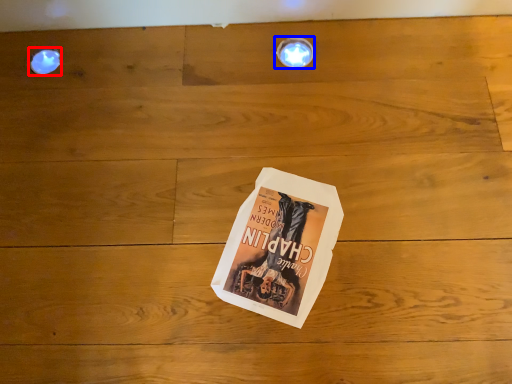
Question: Which object is further to the camera taking this photo, droplight (highlighted by a red box) or light fixture (highlighted by a blue box)?

Choices:
 (A) droplight
 (B) light fixture

Answer: (A)